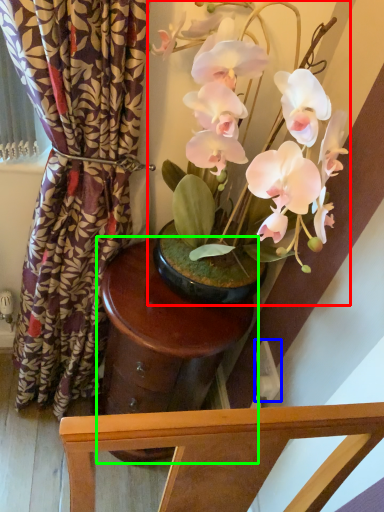
Question: Estimate the real-world distances between objects in this image. Which object is closer to houseplant (highlighted by a red box), power outlet (highlighted by a blue box) or round table (highlighted by a green box)?

Choices:
 (A) power outlet
 (B) round table

Answer: (B)